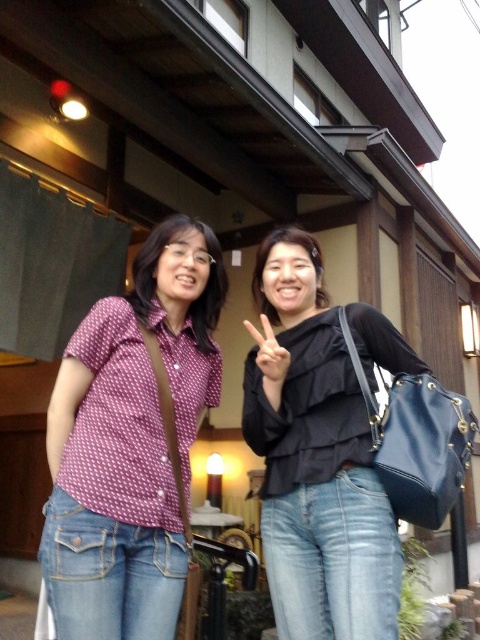
Question: Does matte pink blouse at center have a lesser width compared to white matte hand at center?

Choices:
 (A) no
 (B) yes

Answer: (A)

Question: Can you confirm if matte purple shirt at left is positioned below white matte hand at center?

Choices:
 (A) no
 (B) yes

Answer: (B)

Question: Which object is farther from the camera taking this photo?

Choices:
 (A) black matte top at center
 (B) matte purple shirt at left
 (C) matte pink blouse at center
 (D) denim jeans at lower left

Answer: (C)

Question: Where is matte purple shirt at left located in relation to denim jeans at center in the image?

Choices:
 (A) left
 (B) right

Answer: (A)

Question: Estimate the real-world distances between objects in this image. Which object is closer to the denim jeans at lower left?

Choices:
 (A) denim jeans at center
 (B) matte black blouse at center

Answer: (A)

Question: Which object appears closest to the camera in this image?

Choices:
 (A) white matte hand at center
 (B) denim jeans at center
 (C) matte pink blouse at center
 (D) black matte top at center

Answer: (B)